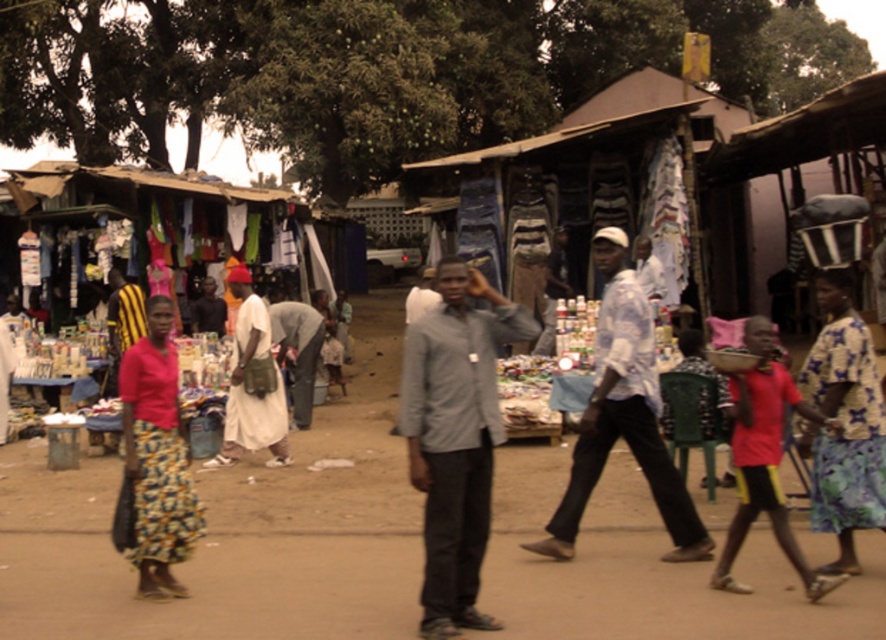
Question: Where is light blue shirt at center located in relation to printed fabric dress at lower right in the image?

Choices:
 (A) below
 (B) above

Answer: (B)

Question: Considering the relative positions of gray cotton shirt at center and light blue shirt at center in the image provided, where is gray cotton shirt at center located with respect to light blue shirt at center?

Choices:
 (A) left
 (B) right

Answer: (A)

Question: Which object appears farthest from the camera in this image?

Choices:
 (A) printed fabric dress at lower right
 (B) floral print skirt at left
 (C) gray cotton shirt at center

Answer: (B)

Question: Which of the following is the closest to the observer?

Choices:
 (A) (842, 320)
 (B) (158, 349)

Answer: (A)

Question: Is floral print skirt at left thinner than white cotton dress at center?

Choices:
 (A) yes
 (B) no

Answer: (A)

Question: Which object is positioned farthest from the white cotton dress at center?

Choices:
 (A) gray cotton shirt at center
 (B) light blue shirt at center
 (C) floral print skirt at left
 (D) printed fabric dress at lower right

Answer: (D)